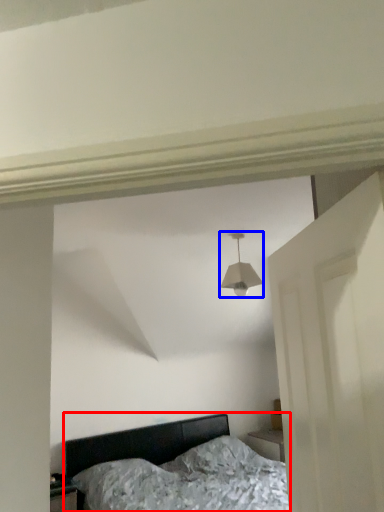
Question: Among these objects, which one is farthest to the camera, bed (highlighted by a red box) or lamp (highlighted by a blue box)?

Choices:
 (A) bed
 (B) lamp

Answer: (B)